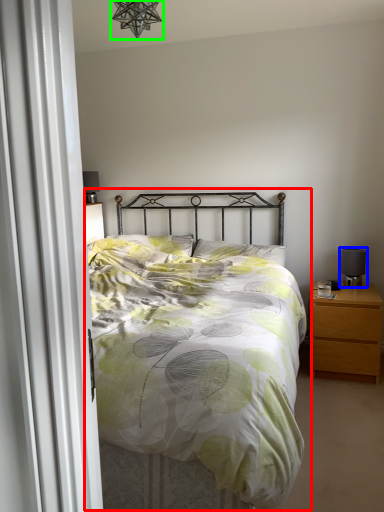
Question: Considering the real-world distances, which object is farthest from bed (highlighted by a red box)? table lamp (highlighted by a blue box) or light fixture (highlighted by a green box)?

Choices:
 (A) table lamp
 (B) light fixture

Answer: (B)